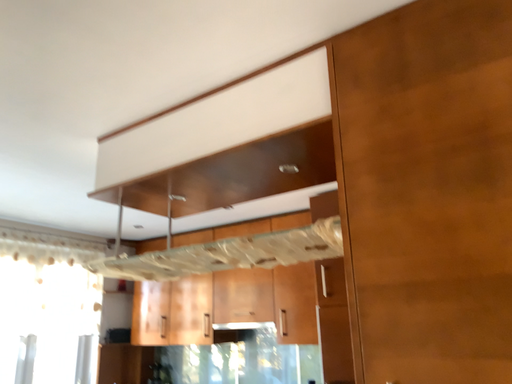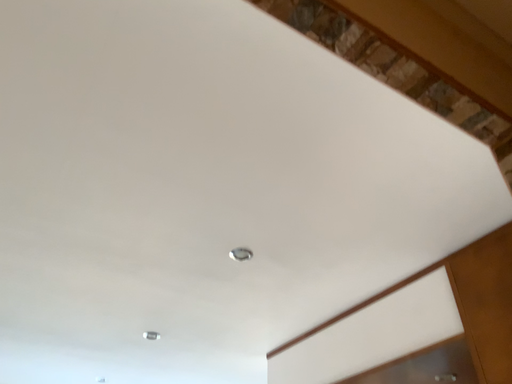
Question: Which way did the camera rotate in the video?

Choices:
 (A) rotated right
 (B) rotated left

Answer: (B)